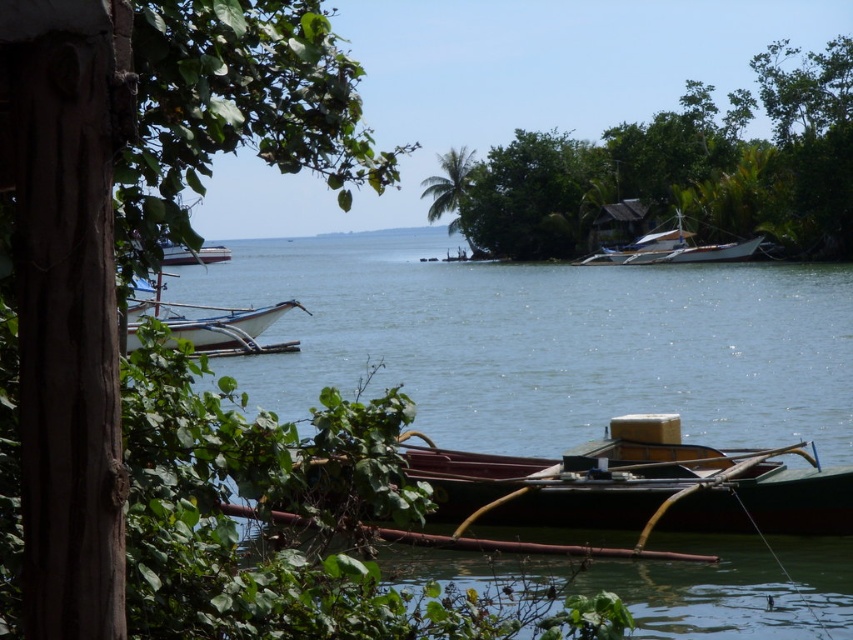
Is wooden boat at center below green leafy tree at center?

Yes, wooden boat at center is below green leafy tree at center.

Can you confirm if wooden boat at center is thinner than green leafy tree at center?

Indeed, wooden boat at center has a lesser width compared to green leafy tree at center.

Describe the element at coordinates (637, 484) in the screenshot. I see `wooden boat at center` at that location.

Locate an element on the screen. This screenshot has height=640, width=853. wooden boat at center is located at coordinates (637, 484).

Is green leafy tree at upper right below wooden boat at center?

Incorrect, green leafy tree at upper right is not positioned below wooden boat at center.

Who is higher up, green leafy tree at upper right or wooden boat at center?

Positioned higher is green leafy tree at upper right.

Locate an element on the screen. This screenshot has height=640, width=853. green leafy tree at upper right is located at coordinates (677, 170).

The width and height of the screenshot is (853, 640). What are the coordinates of `green leafy tree at upper right` in the screenshot? It's located at (677, 170).

Does point (590, 525) come behind point (670, 241)?

That is False.

Is the position of wooden boat at center more distant than that of white wooden boat at center?

That is False.

Is point (759, 477) positioned before point (585, 264)?

Yes.

Find the location of a particular element. This screenshot has height=640, width=853. wooden boat at center is located at coordinates (637, 484).